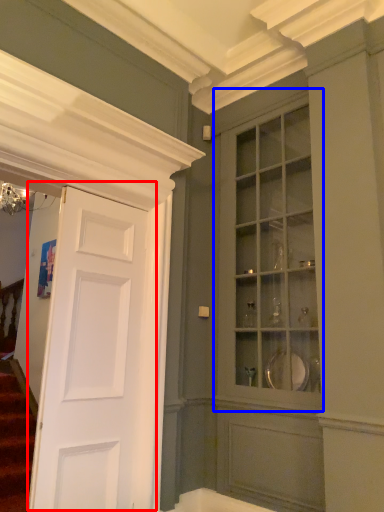
Question: Among these objects, which one is farthest to the camera, door (highlighted by a red box) or cabinetry (highlighted by a blue box)?

Choices:
 (A) door
 (B) cabinetry

Answer: (B)